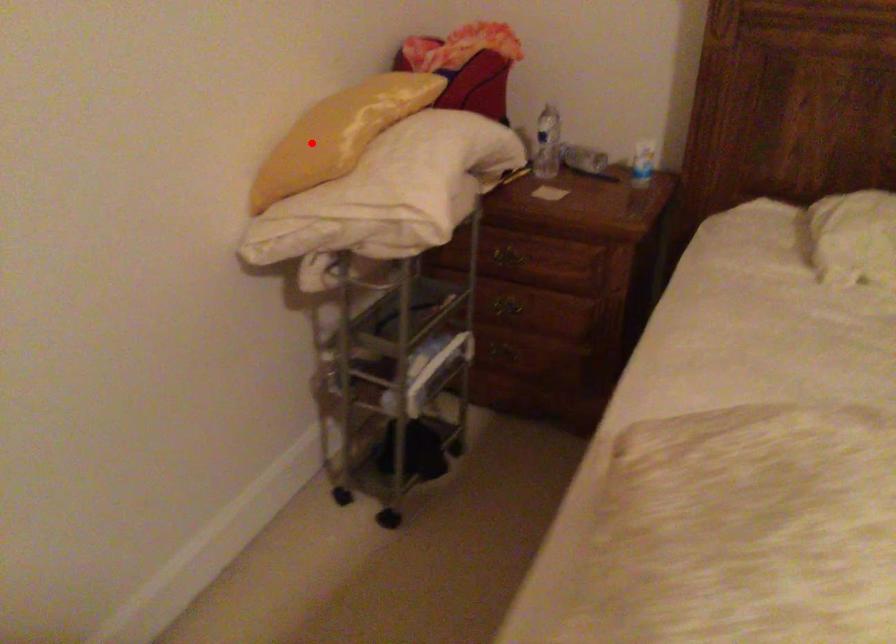
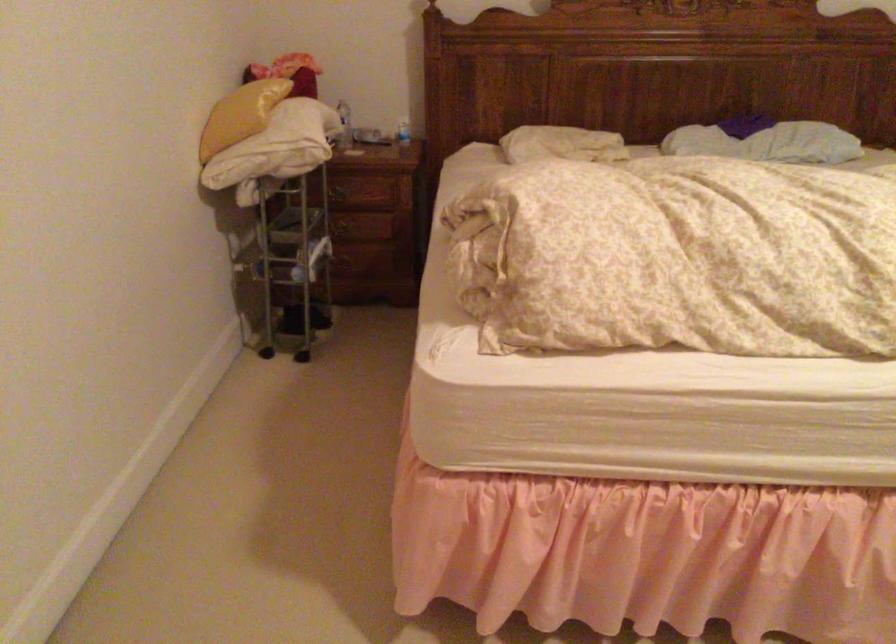
In the second image, find the point that corresponds to the highlighted location in the first image.

(240, 115)